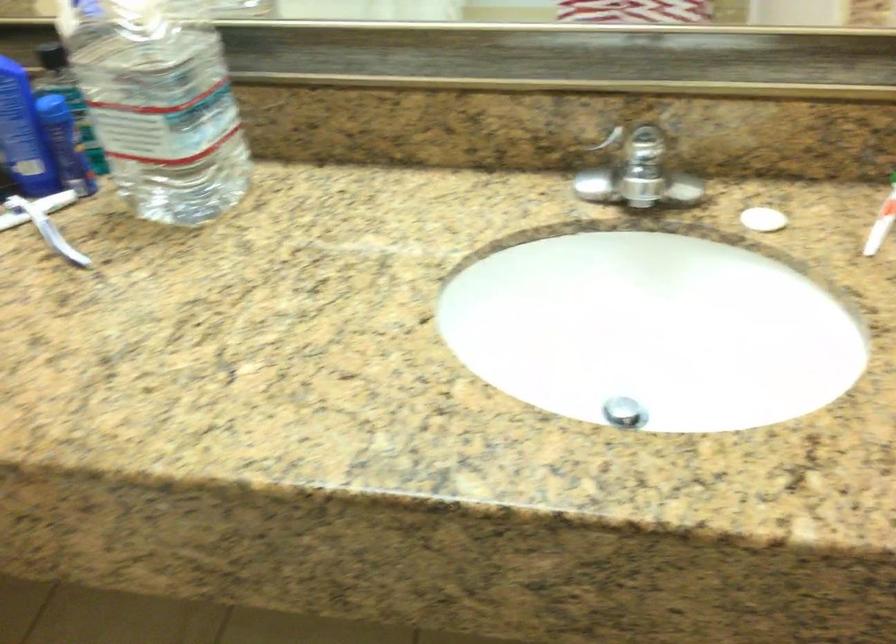
In order to click on red and white toothbrush in this screenshot , I will do `click(881, 222)`.